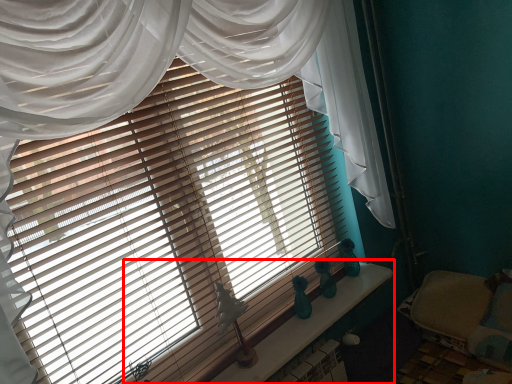
Question: In this image, where is window sill (annotated by the red box) located relative to bed?

Choices:
 (A) left
 (B) right

Answer: (A)